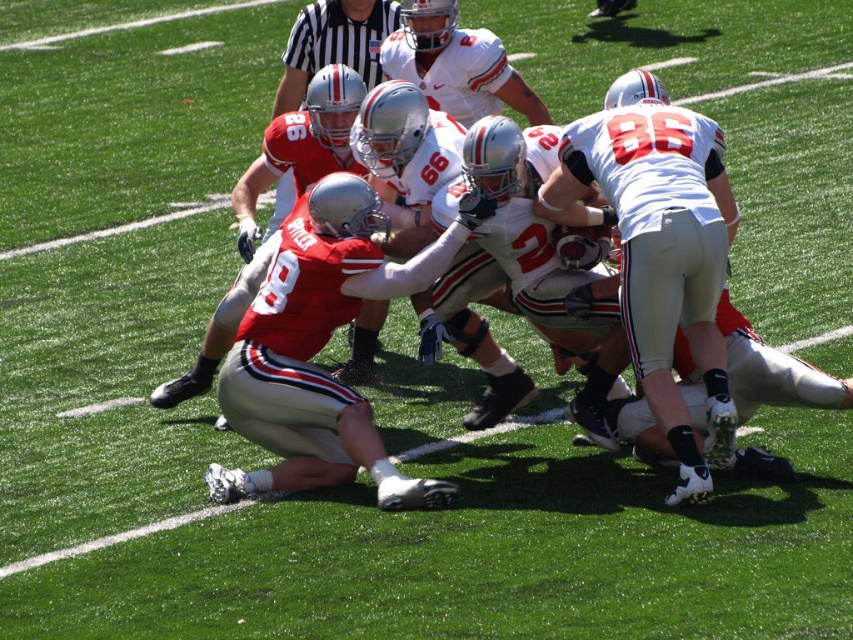
Question: Does matte silver helmet at center appear on the right side of black striped shirt at upper center?

Choices:
 (A) yes
 (B) no

Answer: (B)

Question: Observing the image, what is the correct spatial positioning of matte silver helmet at center in reference to black striped shirt at upper center?

Choices:
 (A) left
 (B) right

Answer: (A)

Question: Among these objects, which one is farthest from the camera?

Choices:
 (A) matte silver helmet at center
 (B) black striped shirt at upper center

Answer: (B)

Question: Among these objects, which one is nearest to the camera?

Choices:
 (A) matte silver helmet at center
 (B) black striped shirt at upper center

Answer: (A)

Question: Among these objects, which one is nearest to the camera?

Choices:
 (A) matte silver helmet at center
 (B) black striped shirt at upper center

Answer: (A)

Question: Considering the relative positions of matte silver helmet at center and black striped shirt at upper center in the image provided, where is matte silver helmet at center located with respect to black striped shirt at upper center?

Choices:
 (A) above
 (B) below

Answer: (B)